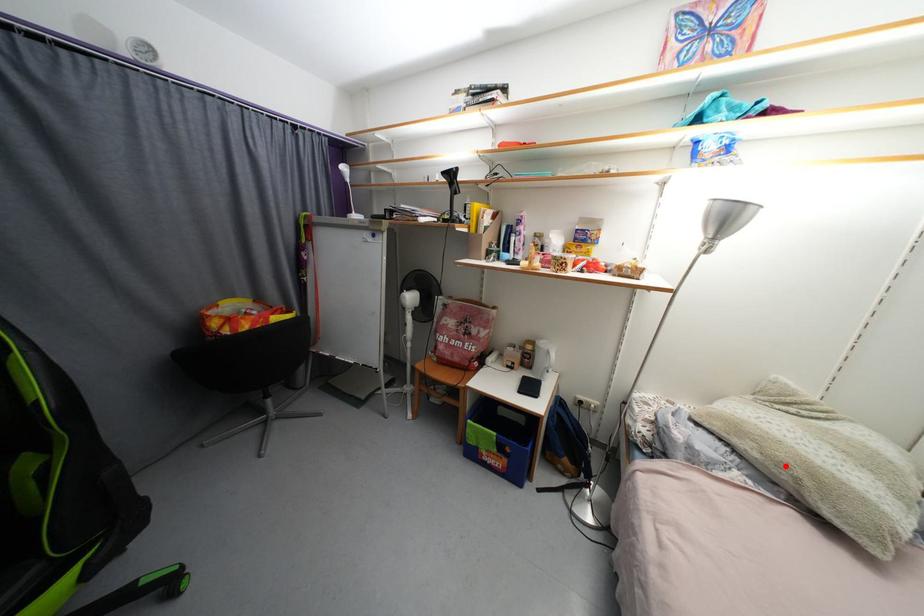
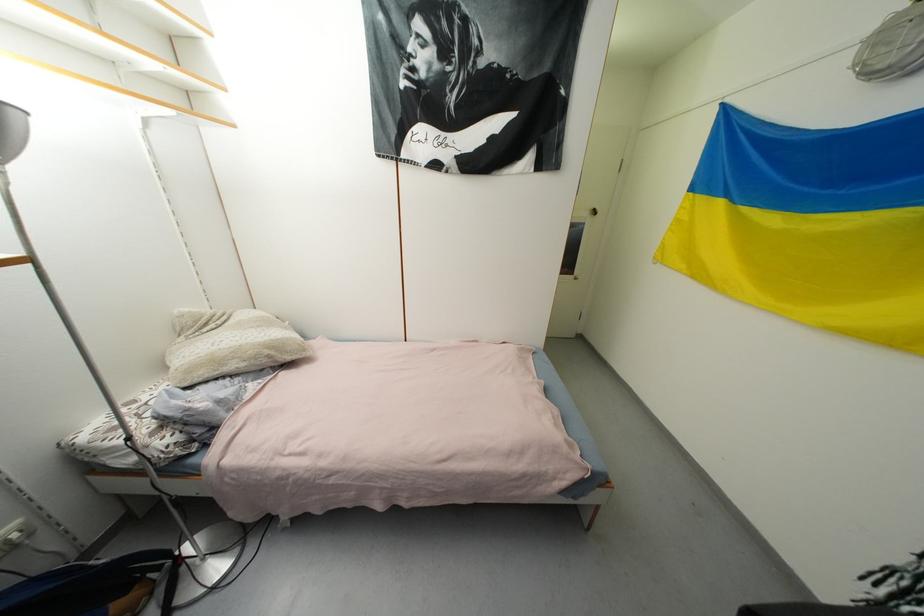
Where in the second image is the point corresponding to the highlighted location from the first image?

(261, 359)